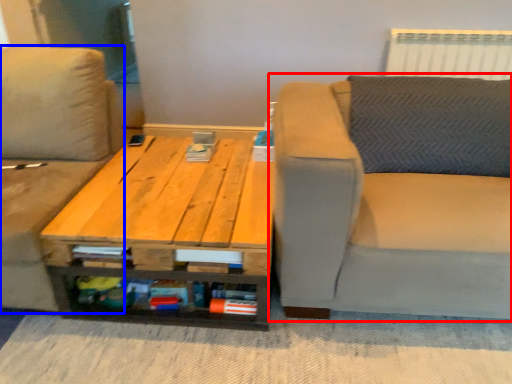
Question: Which object is further to the camera taking this photo, studio couch (highlighted by a red box) or studio couch (highlighted by a blue box)?

Choices:
 (A) studio couch
 (B) studio couch

Answer: (B)